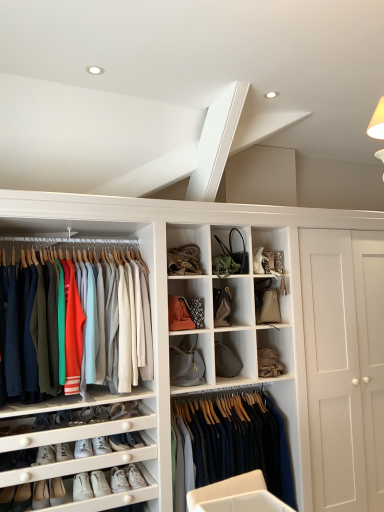
The image size is (384, 512). What do you see at coordinates (266, 302) in the screenshot?
I see `matte leather handbag at upper center, the 2th cabinet positioned from the top` at bounding box center [266, 302].

Describe the element at coordinates (40, 495) in the screenshot. Image resolution: width=384 pixels, height=512 pixels. I see `white leather shoe at lower left, which appears as the 1th shoe when viewed from the left` at that location.

What do you see at coordinates (96, 323) in the screenshot?
I see `knit sweater at left, the first clothing from the left` at bounding box center [96, 323].

What do you see at coordinates (63, 452) in the screenshot? The height and width of the screenshot is (512, 384). I see `white leather sneakers at lower left, the 2th footwear in the left-to-right sequence` at bounding box center [63, 452].

Describe the element at coordinates (101, 445) in the screenshot. The width and height of the screenshot is (384, 512). I see `white leather shoe at lower left, placed as the first shoe when sorted from right to left` at that location.

Identify the location of white leather sneakers at lower left, which is the 4th footwear in right-to-left order. This screenshot has width=384, height=512. (82, 487).

Where is `shoe behind the white leather sneakers at lower left, the 2th footwear in the left-to-right sequence`? This screenshot has height=512, width=384. shoe behind the white leather sneakers at lower left, the 2th footwear in the left-to-right sequence is located at coordinates (101, 445).

From the image's perspective, is white leather shoe at lower left, placed as the first shoe when sorted from right to left, above or below white leather sneakers at lower left, the 2th footwear in the left-to-right sequence?

white leather shoe at lower left, placed as the first shoe when sorted from right to left, is above white leather sneakers at lower left, the 2th footwear in the left-to-right sequence.

Which object is closer to the camera, white leather shoe at lower left, placed as the first shoe when sorted from right to left, or white leather sneakers at lower left, the 2th footwear in the left-to-right sequence?

white leather sneakers at lower left, the 2th footwear in the left-to-right sequence, is closer to the camera.

Is white leather shoe at lower left, positioned as the second shoe in left-to-right order, oriented away from white leather sneakers at lower left, the 5th footwear positioned from the right?

white leather shoe at lower left, positioned as the second shoe in left-to-right order, does not have its back to white leather sneakers at lower left, the 5th footwear positioned from the right.

Is dark blue wool sweater at center, which is the 2th clothing in top-to-bottom order, looking in the opposite direction of white leather sneakers at lower left, which ranks as the 6th footwear in right-to-left order?

dark blue wool sweater at center, which is the 2th clothing in top-to-bottom order, does not have its back to white leather sneakers at lower left, which ranks as the 6th footwear in right-to-left order.

Is dark blue wool sweater at center, positioned as the second clothing in left-to-right order, at the left side of white leather sneakers at lower left, which is the first footwear in left-to-right order?

No, dark blue wool sweater at center, positioned as the second clothing in left-to-right order, is not to the left of white leather sneakers at lower left, which is the first footwear in left-to-right order.

From a real-world perspective, which object stands above the other?

white leather sneakers at lower left, which ranks as the 6th footwear in right-to-left order, is physically above.

Is dark blue wool sweater at center, which is the 2th clothing in top-to-bottom order, further to camera compared to white leather sneakers at lower left, which ranks as the 6th footwear in right-to-left order?

Yes, it is behind white leather sneakers at lower left, which ranks as the 6th footwear in right-to-left order.

Is leather handbag at center, arranged as the 1th cabinet when ordered from the bottom, located outside white leather sneakers at lower left, which is counted as the third footwear, starting from the left?

That's correct, leather handbag at center, arranged as the 1th cabinet when ordered from the bottom, is outside of white leather sneakers at lower left, which is counted as the third footwear, starting from the left.

Consider the image. Is there a large distance between leather handbag at center, the fourth cabinet positioned from the top, and white leather sneakers at lower left, which is the 4th footwear in right-to-left order?

Yes, leather handbag at center, the fourth cabinet positioned from the top, and white leather sneakers at lower left, which is the 4th footwear in right-to-left order, are quite far apart.

Which is in front, leather handbag at center, arranged as the 1th cabinet when ordered from the bottom, or white leather sneakers at lower left, which is counted as the third footwear, starting from the left?

Positioned in front is white leather sneakers at lower left, which is counted as the third footwear, starting from the left.

From a real-world perspective, is leather handbag at center, arranged as the 1th cabinet when ordered from the bottom, physically located above or below white leather sneakers at lower left, which is the 4th footwear in right-to-left order?

Clearly, from a real-world perspective, leather handbag at center, arranged as the 1th cabinet when ordered from the bottom, is above white leather sneakers at lower left, which is the 4th footwear in right-to-left order.

Is gray fabric handbag at center, the first accessory positioned from the left, situated inside matte gray fabric handbag at center, arranged as the 2th cabinet when ordered from the bottom, or outside?

gray fabric handbag at center, the first accessory positioned from the left, is not enclosed by matte gray fabric handbag at center, arranged as the 2th cabinet when ordered from the bottom.

Which object is wider, gray fabric handbag at center, the first accessory positioned from the bottom, or matte gray fabric handbag at center, which is the third cabinet from top to bottom?

With larger width is gray fabric handbag at center, the first accessory positioned from the bottom.

Which of these two, white leather sneakers at lower left, positioned as the sixth footwear in left-to-right order, or white leather shoe at lower left, which appears as the 1th shoe when viewed from the left, is bigger?

Bigger between the two is white leather shoe at lower left, which appears as the 1th shoe when viewed from the left.

Does point (139, 475) lie behind point (47, 490)?

Yes, point (139, 475) is behind point (47, 490).

Is white leather sneakers at lower left, the first footwear positioned from the right, aimed at white leather shoe at lower left, marked as the second shoe in a top-to-bottom arrangement?

No, white leather sneakers at lower left, the first footwear positioned from the right, is not aimed at white leather shoe at lower left, marked as the second shoe in a top-to-bottom arrangement.

Is white leather sneakers at lower left, positioned as the sixth footwear in left-to-right order, far from white leather shoe at lower left, arranged as the 1th shoe when ordered from the bottom?

white leather sneakers at lower left, positioned as the sixth footwear in left-to-right order, is near white leather shoe at lower left, arranged as the 1th shoe when ordered from the bottom, not far away.

Can you tell me how much matte gray fabric handbag at center, arranged as the 2th cabinet when ordered from the bottom, and white leather sneakers at lower left, the first footwear positioned from the right, differ in facing direction?

The facing directions of matte gray fabric handbag at center, arranged as the 2th cabinet when ordered from the bottom, and white leather sneakers at lower left, the first footwear positioned from the right, are 0.665 degrees apart.

Who is shorter, matte gray fabric handbag at center, arranged as the 2th cabinet when ordered from the bottom, or white leather sneakers at lower left, the first footwear positioned from the right?

Standing shorter between the two is white leather sneakers at lower left, the first footwear positioned from the right.

Is point (230, 306) positioned after point (137, 486)?

Yes, point (230, 306) is farther from viewer.

Is dark blue wool sweater at center, positioned as the second clothing in left-to-right order, shorter than matte gray fabric handbag at center, which is the third cabinet from top to bottom?

In fact, dark blue wool sweater at center, positioned as the second clothing in left-to-right order, may be taller than matte gray fabric handbag at center, which is the third cabinet from top to bottom.

From the image's perspective, who appears lower, dark blue wool sweater at center, which is the 2th clothing in top-to-bottom order, or matte gray fabric handbag at center, which is the third cabinet from top to bottom?

dark blue wool sweater at center, which is the 2th clothing in top-to-bottom order, from the image's perspective.

Would you say dark blue wool sweater at center, placed as the 1th clothing when sorted from right to left, is outside matte gray fabric handbag at center, arranged as the 2th cabinet when ordered from the bottom?

Yes, dark blue wool sweater at center, placed as the 1th clothing when sorted from right to left, is outside of matte gray fabric handbag at center, arranged as the 2th cabinet when ordered from the bottom.

Does point (268, 454) come farther from viewer compared to point (235, 293)?

That is False.

The width and height of the screenshot is (384, 512). In order to click on the 4th footwear counting from the left of the white leather shoe at lower left, the 2th shoe in the bottom-to-top sequence in this screenshot , I will do pos(63,452).

This screenshot has height=512, width=384. I want to click on clothing that appears below the white leather sneakers at lower left, which ranks as the 6th footwear in right-to-left order (from a real-world perspective), so click(x=238, y=440).

Which object lies nearer to the anchor point matte leather handbag at upper center, the 2th cabinet positioned from the top, dark blue wool sweater at center, placed as the 1th clothing when sorted from right to left, or gray fabric handbag at center, the first accessory positioned from the bottom?

gray fabric handbag at center, the first accessory positioned from the bottom, lies closer to matte leather handbag at upper center, the 2th cabinet positioned from the top, than the other object.

Which object lies nearer to the anchor point gray fabric handbag at center, the 2th accessory from the top, matte leather handbag at upper center, the 2th cabinet positioned from the top, or matte brown leather handbag at center, the 4th cabinet positioned from the bottom?

matte leather handbag at upper center, the 2th cabinet positioned from the top, is positioned closer to the anchor gray fabric handbag at center, the 2th accessory from the top.

Looking at the image, which one is located further to white leather sneakers at lower left, which ranks as the 6th footwear in right-to-left order, gray fabric handbag at center, the 2th accessory from the top, or white leather sneakers at lower left, the 2th footwear in the left-to-right sequence?

gray fabric handbag at center, the 2th accessory from the top, is further to white leather sneakers at lower left, which ranks as the 6th footwear in right-to-left order.

From the picture: Which object lies nearer to the anchor point leather handbag at center, the fourth cabinet positioned from the top, white leather sneakers at lower left, the third footwear when ordered from right to left, or white leather sneakers at lower left, the 5th footwear viewed from the left?

white leather sneakers at lower left, the third footwear when ordered from right to left.

When comparing their distances from white leather sneakers at lower left, arranged as the fourth footwear when viewed from the left, does gray fabric handbag at center, the first accessory positioned from the left, or white leather shoe at lower left, arranged as the 1th shoe when ordered from the bottom, seem further?

gray fabric handbag at center, the first accessory positioned from the left, lies further to white leather sneakers at lower left, arranged as the fourth footwear when viewed from the left, than the other object.

When comparing their distances from matte brown leather handbag at center, the 4th cabinet positioned from the bottom, does white leather sneakers at lower left, positioned as the sixth footwear in left-to-right order, or white leather sneakers at lower left, the third footwear when ordered from right to left, seem closer?

white leather sneakers at lower left, the third footwear when ordered from right to left, lies closer to matte brown leather handbag at center, the 4th cabinet positioned from the bottom, than the other object.

Based on their spatial positions, is white leather shoe at lower left, placed as the first shoe when sorted from right to left, or leather handbag at center, arranged as the 1th cabinet when ordered from the bottom, closer to white leather shoe at lower left, placed as the 2th shoe when sorted from right to left?

white leather shoe at lower left, placed as the first shoe when sorted from right to left, is positioned closer to the anchor white leather shoe at lower left, placed as the 2th shoe when sorted from right to left.

From the picture: Looking at the image, which one is located closer to matte black handbag at upper center, which appears as the 2th accessory when ordered from the bottom, knit sweater at left, acting as the second clothing starting from the bottom, or white leather sneakers at lower left, the 5th footwear positioned from the right?

knit sweater at left, acting as the second clothing starting from the bottom, is closer to matte black handbag at upper center, which appears as the 2th accessory when ordered from the bottom.

Where is `clothing between knit sweater at left, the 1th clothing from the top, and matte leather handbag at upper center, which is the third cabinet in bottom-to-top order, in the horizontal direction`? clothing between knit sweater at left, the 1th clothing from the top, and matte leather handbag at upper center, which is the third cabinet in bottom-to-top order, in the horizontal direction is located at coordinates (238, 440).

Locate an element on the screen. shoe located between white leather sneakers at lower left, positioned as the 2th footwear in right-to-left order, and matte leather handbag at upper center, which is the third cabinet in bottom-to-top order, in the left-right direction is located at coordinates (101, 445).

You are a GUI agent. You are given a task and a screenshot of the screen. Output one action in this format:
    pyautogui.click(x=<x>, y=<y>)
    Task: Click on the footwear between knit sweater at left, acting as the second clothing starting from the bottom, and white leather shoe at lower left, positioned as the second shoe in left-to-right order, in the vertical direction
    Image resolution: width=384 pixels, height=512 pixels.
    Given the screenshot: What is the action you would take?
    pyautogui.click(x=83, y=448)

Locate an element on the screen. The height and width of the screenshot is (512, 384). accessory between knit sweater at left, the first clothing from the left, and white leather shoe at lower left, positioned as the second shoe in left-to-right order, in the up-down direction is located at coordinates (186, 362).